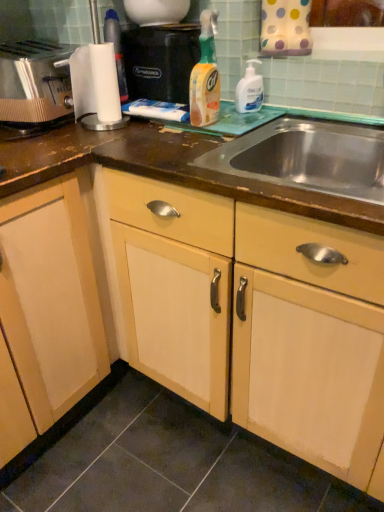
This screenshot has height=512, width=384. I want to click on empty space that is ontop of black plastic coffee machine at upper center (from a real-world perspective), so click(x=163, y=22).